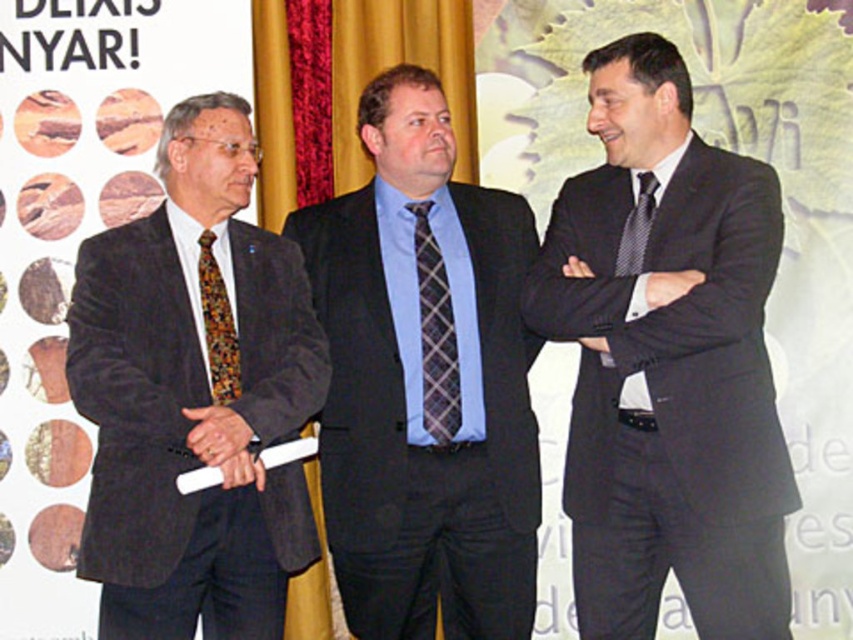
Where is the velvet brown suit at left located in the image?

The velvet brown suit at left is located at point 0.616 on the x axis and 0.229 on the y axis.